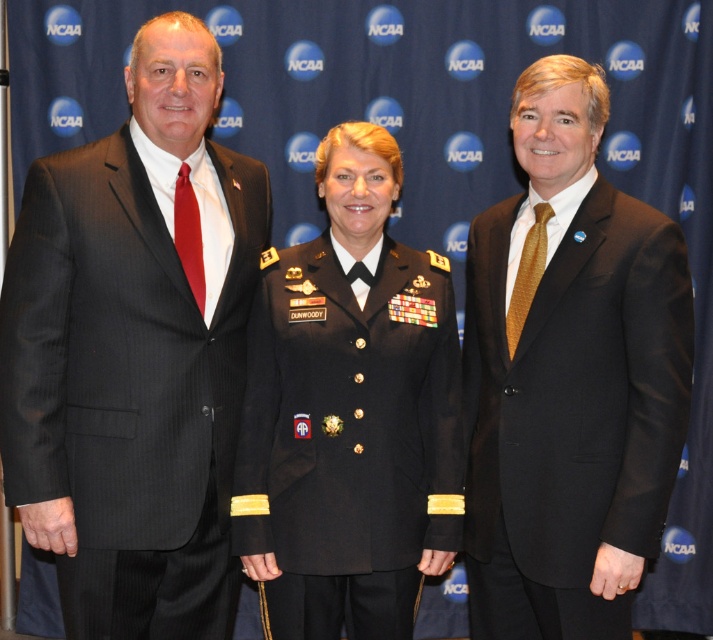
Does matte black suit at left appear over matte black suit at center?

Indeed, matte black suit at left is positioned over matte black suit at center.

Is point (128, 564) farther from viewer compared to point (466, 474)?

No.

You are a GUI agent. You are given a task and a screenshot of the screen. Output one action in this format:
    pyautogui.click(x=<x>, y=<y>)
    Task: Click on the matte black suit at left
    The image size is (713, 640).
    Given the screenshot: What is the action you would take?
    pyautogui.click(x=133, y=352)

How far apart are matte black suit at center and black uniform at center?

matte black suit at center is 12.02 inches away from black uniform at center.

Does point (687, 316) come in front of point (329, 544)?

Yes.

Identify the location of matte black suit at center. This screenshot has height=640, width=713. (569, 376).

Is matte black suit at left to the right of black uniform at center from the viewer's perspective?

In fact, matte black suit at left is to the left of black uniform at center.

Which is above, matte black suit at left or black uniform at center?

matte black suit at left is higher up.

Is point (31, 476) in front of point (282, 522)?

Yes, point (31, 476) is closer to viewer.

The height and width of the screenshot is (640, 713). Find the location of `matte black suit at left`. matte black suit at left is located at coordinates (133, 352).